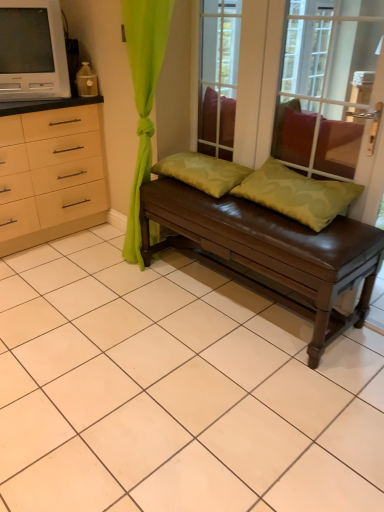
Image resolution: width=384 pixels, height=512 pixels. What do you see at coordinates (269, 250) in the screenshot? I see `brown leather bench at center` at bounding box center [269, 250].

What do you see at coordinates (297, 194) in the screenshot?
I see `green matte pillow at center, which is the 1th pillow in right-to-left order` at bounding box center [297, 194].

What do you see at coordinates (203, 172) in the screenshot? I see `green fabric pillow at center, marked as the first pillow in a left-to-right arrangement` at bounding box center [203, 172].

Locate an element on the screen. The width and height of the screenshot is (384, 512). transparent glass window screen at upper center is located at coordinates pos(218,76).

Is green fabric pillow at center, which ranks as the 2th pillow in right-to-left order, at the back of transparent glass window screen at upper center?

transparent glass window screen at upper center does not have its back to green fabric pillow at center, which ranks as the 2th pillow in right-to-left order.

Considering the sizes of objects transparent glass window screen at upper center and green fabric pillow at center, which ranks as the 2th pillow in right-to-left order, in the image provided, who is wider, transparent glass window screen at upper center or green fabric pillow at center, which ranks as the 2th pillow in right-to-left order,?

Wider between the two is green fabric pillow at center, which ranks as the 2th pillow in right-to-left order.

Considering the relative positions of transparent glass window screen at upper center and green fabric pillow at center, marked as the first pillow in a left-to-right arrangement, in the image provided, is transparent glass window screen at upper center to the left or to the right of green fabric pillow at center, marked as the first pillow in a left-to-right arrangement,?

Clearly, transparent glass window screen at upper center is on the right of green fabric pillow at center, marked as the first pillow in a left-to-right arrangement, in the image.

Considering the sizes of transparent glass window screen at upper center and green fabric pillow at center, which ranks as the 2th pillow in right-to-left order, in the image, is transparent glass window screen at upper center taller or shorter than green fabric pillow at center, which ranks as the 2th pillow in right-to-left order,?

Considering their sizes, transparent glass window screen at upper center has more height than green fabric pillow at center, which ranks as the 2th pillow in right-to-left order.

Is point (216, 3) closer or farther from the camera than point (12, 11)?

Clearly, point (216, 3) is more distant from the camera than point (12, 11).

Which object is wider, transparent glass window screen at upper center or matte white television at upper left?

With larger width is matte white television at upper left.

Which of these two, transparent glass window screen at upper center or matte white television at upper left, stands taller?

Standing taller between the two is transparent glass window screen at upper center.

From a real-world perspective, which is physically above, transparent glass window screen at upper center or matte white television at upper left?

matte white television at upper left.

From the image's perspective, who appears lower, matte white television at upper left or green matte pillow at center, which is the 1th pillow in right-to-left order?

green matte pillow at center, which is the 1th pillow in right-to-left order, is shown below in the image.

Can you confirm if matte white television at upper left is taller than green matte pillow at center, which is the 1th pillow in right-to-left order?

Yes, matte white television at upper left is taller than green matte pillow at center, which is the 1th pillow in right-to-left order.

Between matte white television at upper left and green matte pillow at center, which is the second pillow from left to right, which one appears on the right side from the viewer's perspective?

From the viewer's perspective, green matte pillow at center, which is the second pillow from left to right, appears more on the right side.

Is green matte pillow at center, which is the 1th pillow in right-to-left order, at the back of matte white television at upper left?

No, matte white television at upper left is not facing the opposite direction of green matte pillow at center, which is the 1th pillow in right-to-left order.

Which is closer, (191, 176) or (200, 7)?

Positioned in front is point (191, 176).

From a real-world perspective, which is physically above, green fabric pillow at center, which ranks as the 2th pillow in right-to-left order, or transparent glass window screen at upper center?

transparent glass window screen at upper center is physically above.

Is there a large distance between green fabric pillow at center, which ranks as the 2th pillow in right-to-left order, and transparent glass window screen at upper center?

That's right, there is a large distance between green fabric pillow at center, which ranks as the 2th pillow in right-to-left order, and transparent glass window screen at upper center.

Can you tell me how much green fabric pillow at center, marked as the first pillow in a left-to-right arrangement, and transparent glass window screen at upper center differ in facing direction?

The facing directions of green fabric pillow at center, marked as the first pillow in a left-to-right arrangement, and transparent glass window screen at upper center are 1.03 degrees apart.

Is green fabric pillow at center, marked as the first pillow in a left-to-right arrangement, looking in the opposite direction of brown leather bench at center?

green fabric pillow at center, marked as the first pillow in a left-to-right arrangement, does not have its back to brown leather bench at center.

From a real-world perspective, is green fabric pillow at center, which ranks as the 2th pillow in right-to-left order, above or below brown leather bench at center?

Clearly, from a real-world perspective, green fabric pillow at center, which ranks as the 2th pillow in right-to-left order, is above brown leather bench at center.

Locate an element on the screen. The height and width of the screenshot is (512, 384). the 2nd pillow above when counting from the brown leather bench at center (from the image's perspective) is located at coordinates (203, 172).

Based on the photo, are transparent glass window screen at upper center and green matte pillow at center, which is the second pillow from left to right, making contact?

No, transparent glass window screen at upper center is not making contact with green matte pillow at center, which is the second pillow from left to right.

In the scene shown: How distant is transparent glass window screen at upper center from green matte pillow at center, which is the 1th pillow in right-to-left order?

The distance of transparent glass window screen at upper center from green matte pillow at center, which is the 1th pillow in right-to-left order, is 7.94 feet.

This screenshot has width=384, height=512. What are the coordinates of `window screen lying above the green matte pillow at center, which is the 1th pillow in right-to-left order (from the image's perspective)` in the screenshot? It's located at (218, 76).

Is transparent glass window screen at upper center taller or shorter than green matte pillow at center, which is the second pillow from left to right?

In the image, transparent glass window screen at upper center appears to be taller than green matte pillow at center, which is the second pillow from left to right.

Which of these two, green matte pillow at center, which is the second pillow from left to right, or transparent glass window screen at upper center, is smaller?

With smaller size is transparent glass window screen at upper center.

From the image's perspective, is green matte pillow at center, which is the second pillow from left to right, beneath transparent glass window screen at upper center?

Yes.

Do you think green matte pillow at center, which is the 1th pillow in right-to-left order, is within transparent glass window screen at upper center, or outside of it?

green matte pillow at center, which is the 1th pillow in right-to-left order, is located beyond the bounds of transparent glass window screen at upper center.

Which is behind, point (327, 192) or point (233, 132)?

The point (233, 132) is farther.

Where is `window screen to the right of green fabric pillow at center, marked as the first pillow in a left-to-right arrangement`? window screen to the right of green fabric pillow at center, marked as the first pillow in a left-to-right arrangement is located at coordinates (218, 76).

Find the location of a particular element. The height and width of the screenshot is (512, 384). television that is behind the transparent glass window screen at upper center is located at coordinates pyautogui.click(x=32, y=51).

Based on their spatial positions, is brown leather bench at center or green matte pillow at center, which is the 1th pillow in right-to-left order, closer to matte white television at upper left?

Among the two, brown leather bench at center is located nearer to matte white television at upper left.

When comparing their distances from matte white television at upper left, does brown leather bench at center or transparent glass window screen at upper center seem further?

transparent glass window screen at upper center lies further to matte white television at upper left than the other object.

Looking at the image, which one is located closer to green fabric pillow at center, marked as the first pillow in a left-to-right arrangement, green matte pillow at center, which is the second pillow from left to right, or brown leather bench at center?

green matte pillow at center, which is the second pillow from left to right.

Considering their positions, is brown leather bench at center positioned closer to green fabric pillow at center, which ranks as the 2th pillow in right-to-left order, than matte white television at upper left?

The object closer to green fabric pillow at center, which ranks as the 2th pillow in right-to-left order, is brown leather bench at center.

Considering their positions, is green fabric pillow at center, which ranks as the 2th pillow in right-to-left order, positioned closer to brown leather bench at center than transparent glass window screen at upper center?

Among the two, green fabric pillow at center, which ranks as the 2th pillow in right-to-left order, is located nearer to brown leather bench at center.

Estimate the real-world distances between objects in this image. Which object is closer to green fabric pillow at center, which ranks as the 2th pillow in right-to-left order, matte white television at upper left or transparent glass window screen at upper center?

The object closer to green fabric pillow at center, which ranks as the 2th pillow in right-to-left order, is matte white television at upper left.

Which object lies further to the anchor point transparent glass window screen at upper center, matte white television at upper left or brown leather bench at center?

The object further to transparent glass window screen at upper center is brown leather bench at center.

In the scene shown: From the image, which object appears to be farther from green matte pillow at center, which is the 1th pillow in right-to-left order, green fabric pillow at center, marked as the first pillow in a left-to-right arrangement, or transparent glass window screen at upper center?

The object further to green matte pillow at center, which is the 1th pillow in right-to-left order, is transparent glass window screen at upper center.

Locate an element on the screen. The height and width of the screenshot is (512, 384). window screen situated between matte white television at upper left and green matte pillow at center, which is the second pillow from left to right, from left to right is located at coordinates (218, 76).

You are a GUI agent. You are given a task and a screenshot of the screen. Output one action in this format:
    pyautogui.click(x=<x>, y=<y>)
    Task: Click on the pillow between brown leather bench at center and green fabric pillow at center, marked as the first pillow in a left-to-right arrangement, from front to back
    The image size is (384, 512).
    Given the screenshot: What is the action you would take?
    pyautogui.click(x=297, y=194)

Locate an element on the screen. The width and height of the screenshot is (384, 512). studio couch located between matte white television at upper left and green matte pillow at center, which is the 1th pillow in right-to-left order, in the left-right direction is located at coordinates (269, 250).

Locate an element on the screen. The width and height of the screenshot is (384, 512). pillow between matte white television at upper left and green matte pillow at center, which is the second pillow from left to right, from left to right is located at coordinates (203, 172).